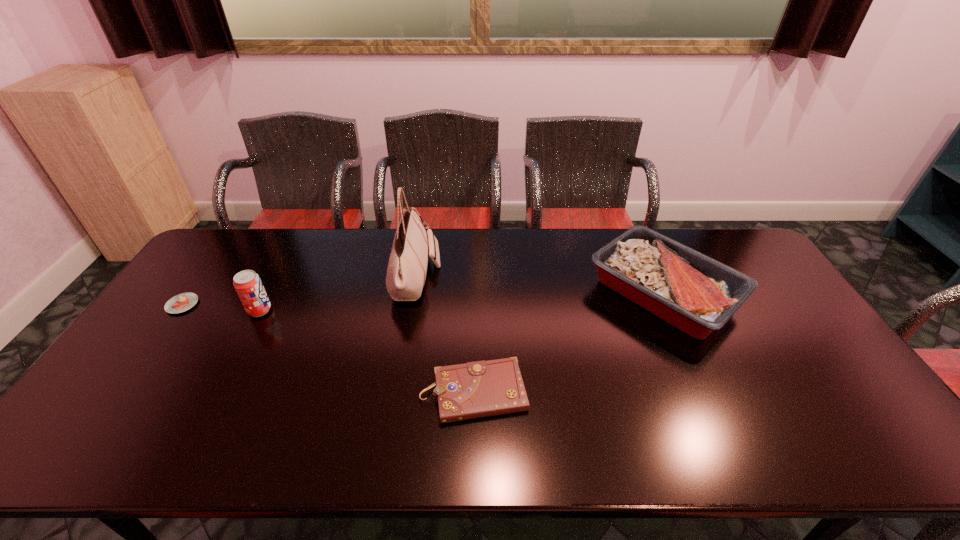
This screenshot has height=540, width=960. What are the coordinates of `vacant area at the far left corner of the desktop` in the screenshot? It's located at (219, 264).

You are a GUI agent. You are given a task and a screenshot of the screen. Output one action in this format:
    pyautogui.click(x=<x>, y=<y>)
    Task: Click on the free area in between the fourth tallest object and the handbag
    Image resolution: width=960 pixels, height=540 pixels.
    Given the screenshot: What is the action you would take?
    click(x=445, y=334)

I want to click on unoccupied area between the soda can and the tallest object, so click(338, 294).

The height and width of the screenshot is (540, 960). Identify the location of free area in between the rightmost object and the tallest object. (540, 285).

In order to click on empty location between the tallest object and the notebook in this screenshot , I will do `click(445, 334)`.

The height and width of the screenshot is (540, 960). Identify the location of vacant space that's between the tray and the handbag. (540, 285).

The image size is (960, 540). What are the coordinates of `free space between the second object from left to right and the rightmost object` in the screenshot? It's located at point(462,302).

This screenshot has width=960, height=540. I want to click on free spot between the second shortest object and the second object from left to right, so click(x=367, y=352).

I want to click on empty space between the tallest object and the fourth object from right to left, so [x=338, y=294].

Find the location of `unoccupied area between the fourth object from right to left and the shortest object`. unoccupied area between the fourth object from right to left and the shortest object is located at coordinates (221, 307).